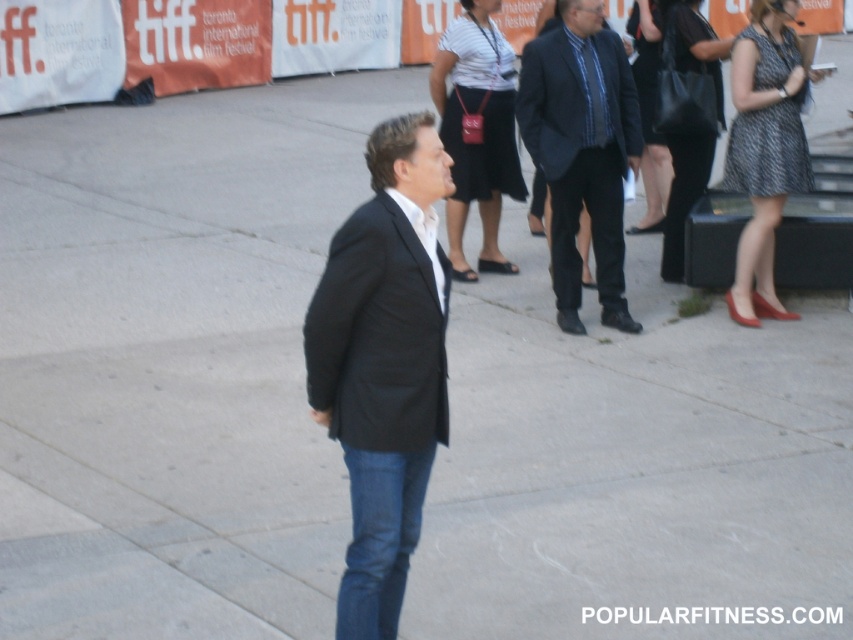
Question: Does black matte suit at center appear on the right side of black leather handbag at upper right?

Choices:
 (A) yes
 (B) no

Answer: (B)

Question: Which is nearer to the matte black dress at upper right?

Choices:
 (A) black matte suit at center
 (B) printed fabric dress at right
 (C) dark blue textured suit at center
 (D) black leather handbag at upper right

Answer: (D)

Question: Considering the relative positions of printed fabric dress at right and black leather handbag at upper right in the image provided, where is printed fabric dress at right located with respect to black leather handbag at upper right?

Choices:
 (A) above
 (B) below

Answer: (B)

Question: Can you confirm if black matte suit at center is positioned to the left of black leather handbag at upper right?

Choices:
 (A) no
 (B) yes

Answer: (B)

Question: Which point is farther to the camera?

Choices:
 (A) black matte suit at center
 (B) matte black dress at upper right
 (C) dark blue textured suit at center
 (D) black leather handbag at upper right

Answer: (B)

Question: Among these points, which one is farthest from the camera?

Choices:
 (A) (469, 148)
 (B) (790, 184)
 (C) (556, 262)

Answer: (A)